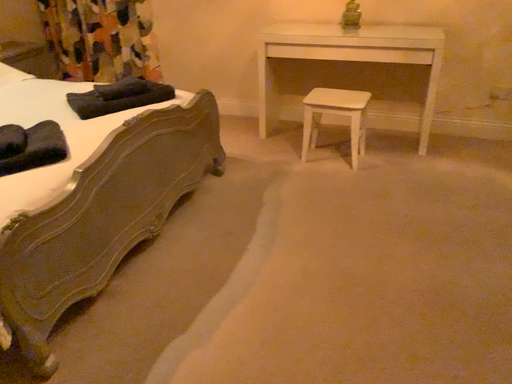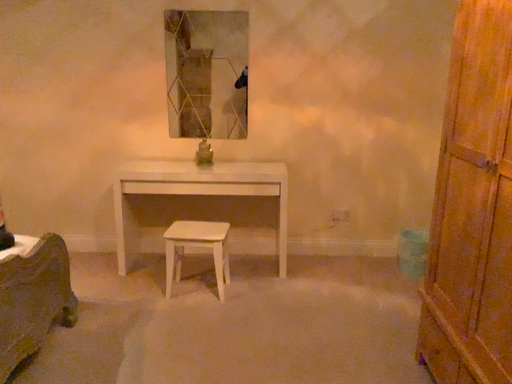
Question: Which way did the camera rotate in the video?

Choices:
 (A) rotated left
 (B) rotated right

Answer: (B)